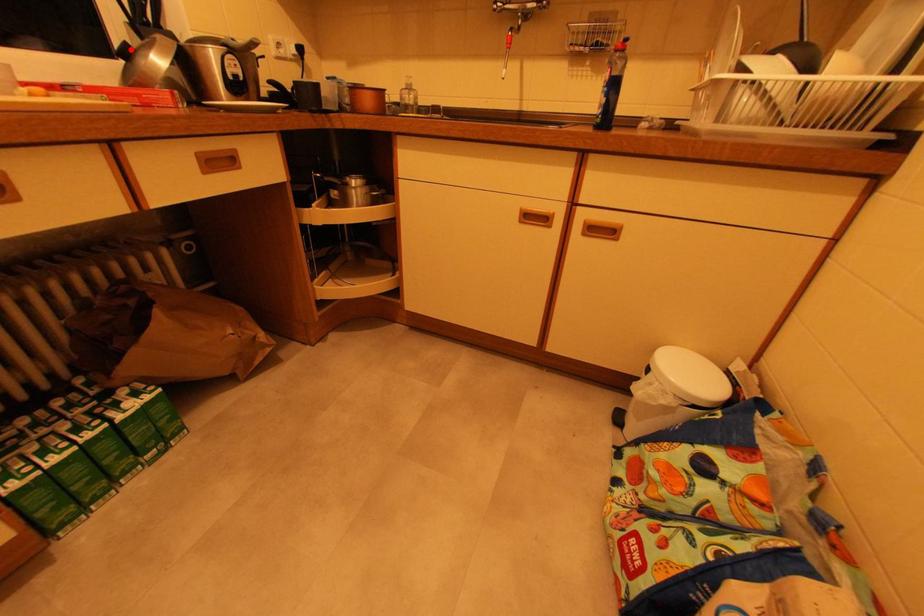
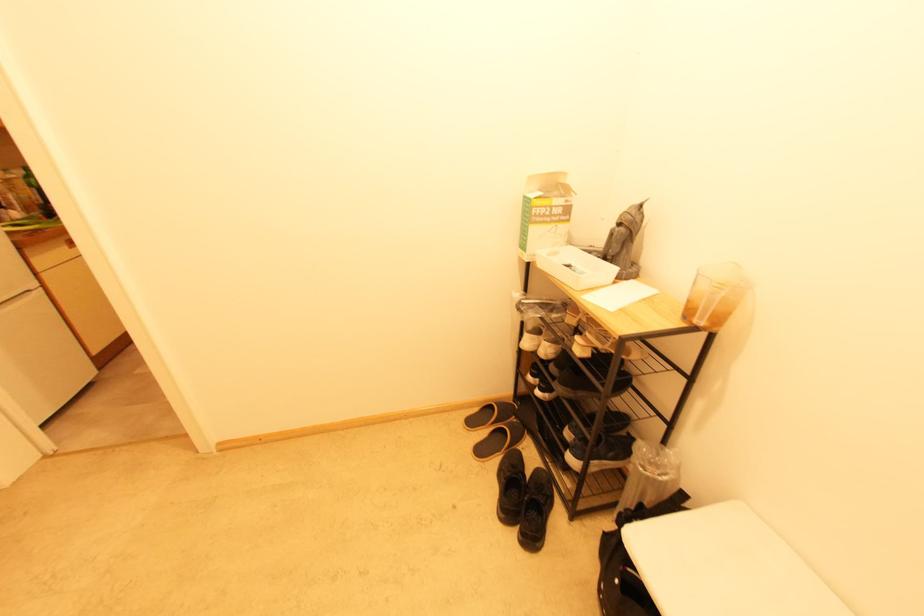
Question: I am providing you with two images of the same scene from different viewpoints. A red point is marked on the first image. At the location where the point appears in image 1, is it still visible in image 2?

Choices:
 (A) Yes
 (B) No

Answer: (B)